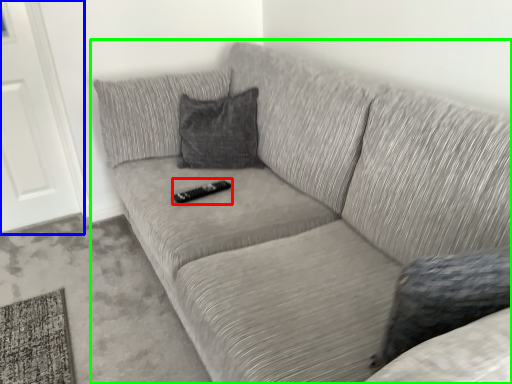
Question: Based on their relative distances, which object is nearer to remote (highlighted by a red box)? Choose from door (highlighted by a blue box) and studio couch (highlighted by a green box).

Choices:
 (A) door
 (B) studio couch

Answer: (B)